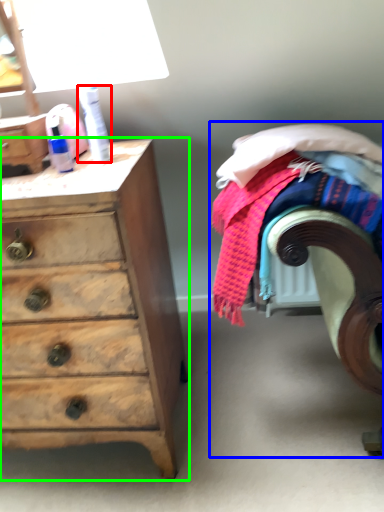
Question: Which object is positioned farthest from toiletry (highlighted by a red box)? Select from bed (highlighted by a blue box) and chest of drawers (highlighted by a green box).

Choices:
 (A) bed
 (B) chest of drawers

Answer: (A)